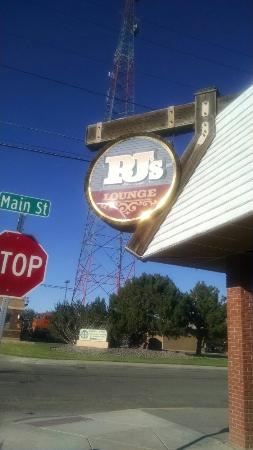
At what (x,y) coordinates should I click in order to perform the action: click on wall. Please return your answer as a coordinate pair (x, y). The width and height of the screenshot is (253, 450). Looking at the image, I should click on (129, 351).